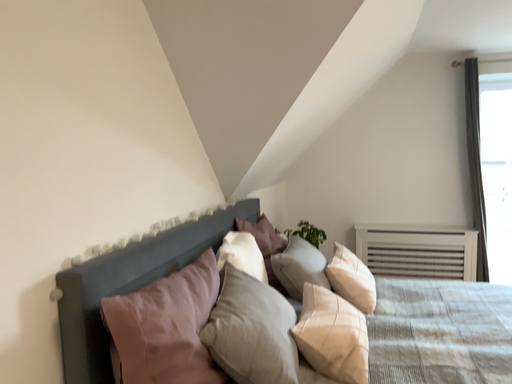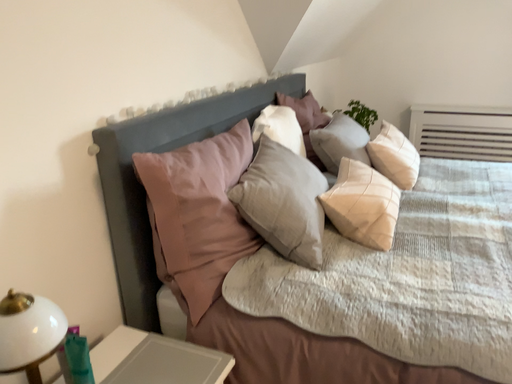
Question: How did the camera likely rotate when shooting the video?

Choices:
 (A) rotated left
 (B) rotated right

Answer: (A)